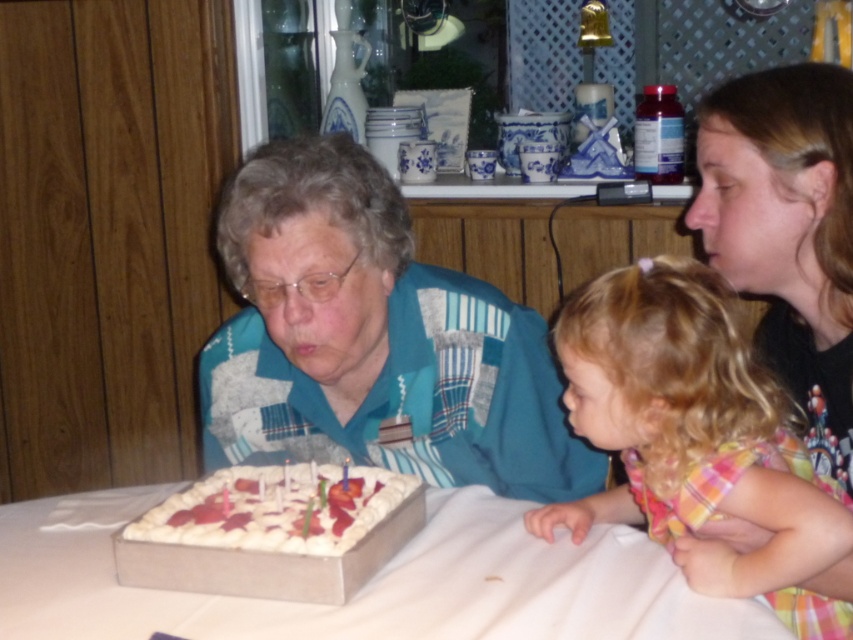
Question: Can you confirm if teal patchwork shirt at center is positioned above white cardboard cake at lower center?

Choices:
 (A) yes
 (B) no

Answer: (A)

Question: Is teal patchwork shirt at center bigger than white textured cake at center?

Choices:
 (A) yes
 (B) no

Answer: (A)

Question: Is teal patchwork shirt at center closer to camera compared to white textured cake at center?

Choices:
 (A) yes
 (B) no

Answer: (B)

Question: Which of the following is the closest to the observer?

Choices:
 (A) teal patchwork shirt at center
 (B) white textured cake at center
 (C) white cardboard cake at lower center
 (D) blonde hair at right

Answer: (C)

Question: Which object is the closest to the white cardboard cake at lower center?

Choices:
 (A) blonde hair at right
 (B) blonde hair at lower right
 (C) teal patchwork shirt at center

Answer: (B)

Question: Which point is farther from the camera taking this photo?

Choices:
 (A) (805, 515)
 (B) (340, 500)

Answer: (B)